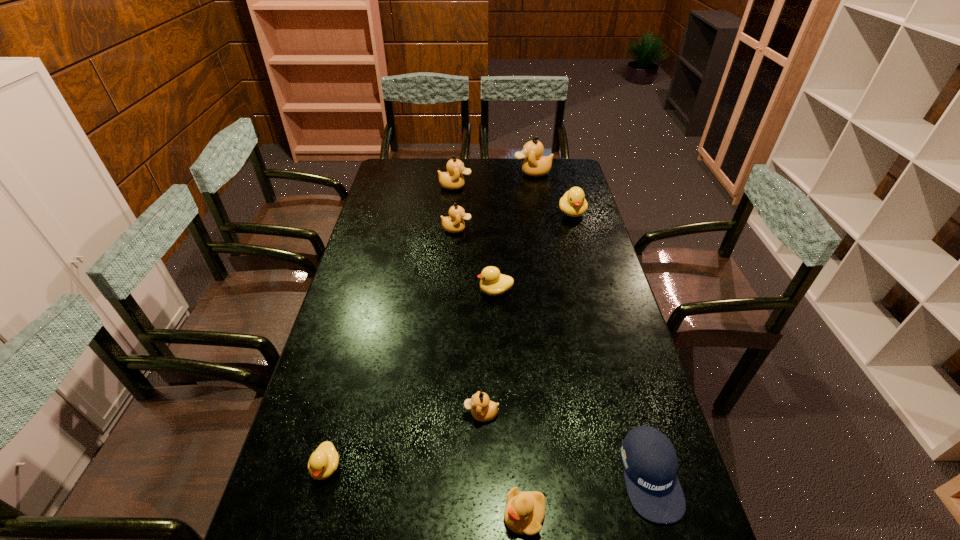
You are a GUI agent. You are given a task and a screenshot of the screen. Output one action in this format:
    pyautogui.click(x=<x>, y=<y>)
    Task: Click on the free location located 0.350m on the face of the third biggest tan duckling
    The image size is (960, 540).
    Given the screenshot: What is the action you would take?
    pyautogui.click(x=560, y=229)

Locate an element on the screen. This screenshot has width=960, height=540. vacant space located 0.050m on the beak of the third nearest yellow duckling is located at coordinates (463, 291).

The image size is (960, 540). I want to click on vacant position located 0.200m on the beak of the third nearest yellow duckling, so [x=418, y=291].

In order to click on free space located 0.080m on the beak of the third nearest yellow duckling in this screenshot , I will do `click(453, 291)`.

The height and width of the screenshot is (540, 960). What are the coordinates of `vacant space located 0.210m on the face of the smallest tan duckling` in the screenshot? It's located at (383, 414).

At what (x,y) coordinates should I click in order to perform the action: click on free space located 0.400m on the face of the smallest tan duckling. Please return your answer as a coordinate pair (x, y). This screenshot has width=960, height=540. Looking at the image, I should click on (309, 414).

Where is `vacant space located on the face of the smallest tan duckling`? vacant space located on the face of the smallest tan duckling is located at coordinates (352, 414).

This screenshot has width=960, height=540. Identify the location of vacant space situated 0.190m on the beak of the nearest yellow duckling. (417, 515).

You are a GUI agent. You are given a task and a screenshot of the screen. Output one action in this format:
    pyautogui.click(x=<x>, y=<y>)
    Task: Click on the vacant space situated 0.280m on the beak of the nearest yellow duckling
    Image resolution: width=960 pixels, height=540 pixels.
    Given the screenshot: What is the action you would take?
    pyautogui.click(x=375, y=515)

At what (x,y) coordinates should I click in order to perform the action: click on vacant space located 0.050m on the beak of the nearest yellow duckling. Please return your answer as a coordinate pair (x, y). Image resolution: width=960 pixels, height=540 pixels. Looking at the image, I should click on (481, 515).